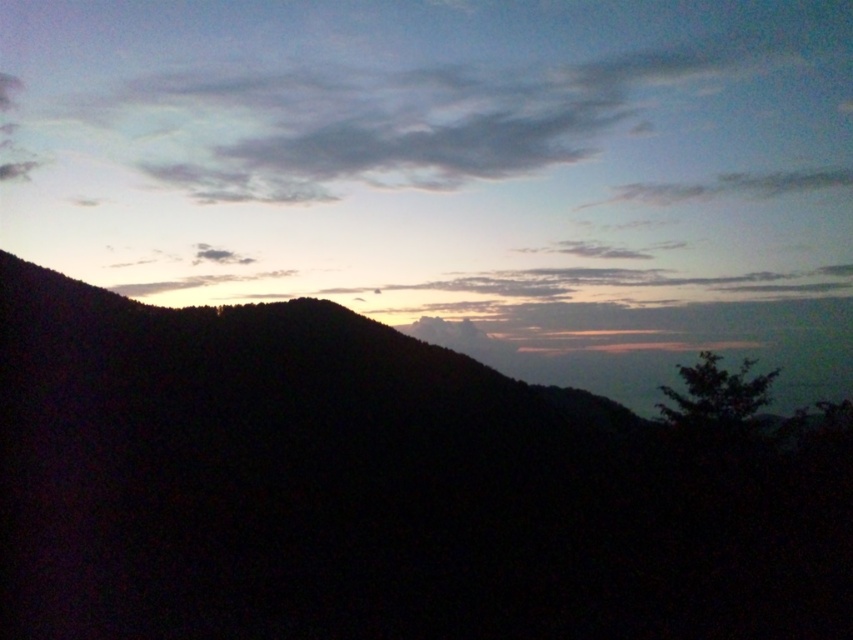
Between point (300, 284) and point (347, 348), which one is positioned behind?

The point (300, 284) is more distant.

Describe the element at coordinates (456, 172) in the screenshot. This screenshot has width=853, height=640. I see `matte orange sky at upper center` at that location.

The height and width of the screenshot is (640, 853). I want to click on matte orange sky at upper center, so click(x=456, y=172).